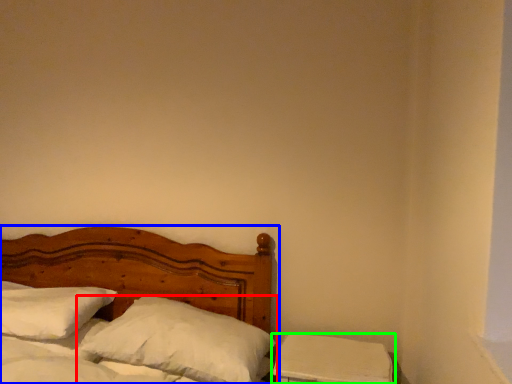
Question: Estimate the real-world distances between objects in this image. Which object is farther from pillow (highlighted by a red box), bed (highlighted by a blue box) or nightstand (highlighted by a green box)?

Choices:
 (A) bed
 (B) nightstand

Answer: (A)